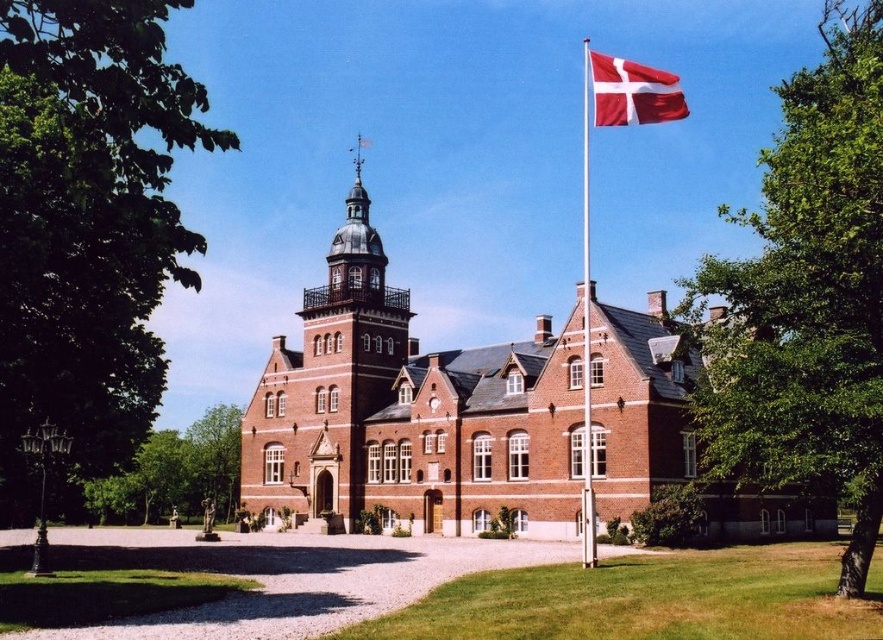
Does brick tower at center appear over white metallic flag pole at upper right?

No.

Does point (270, 374) come farther from viewer compared to point (585, 132)?

No.

Who is more distant from viewer, (404,324) or (587,211)?

Point (587,211)

In order to click on brick tower at center in this screenshot , I will do `click(331, 388)`.

Is red fabric flag at upper right to the right of white metallic flag pole at upper right from the viewer's perspective?

Indeed, red fabric flag at upper right is positioned on the right side of white metallic flag pole at upper right.

Measure the distance between red fabric flag at upper right and camera.

They are 55.30 meters apart.

Find the location of `red fabric flag at upper right`. red fabric flag at upper right is located at coordinates (632, 92).

Between brick tower at center and red fabric flag at upper right, which one has more height?

Standing taller between the two is brick tower at center.

Which is below, brick tower at center or red fabric flag at upper right?

Positioned lower is brick tower at center.

You are a GUI agent. You are given a task and a screenshot of the screen. Output one action in this format:
    pyautogui.click(x=<x>, y=<y>)
    Task: Click on the brick tower at center
    The height and width of the screenshot is (640, 883).
    Given the screenshot: What is the action you would take?
    pyautogui.click(x=331, y=388)